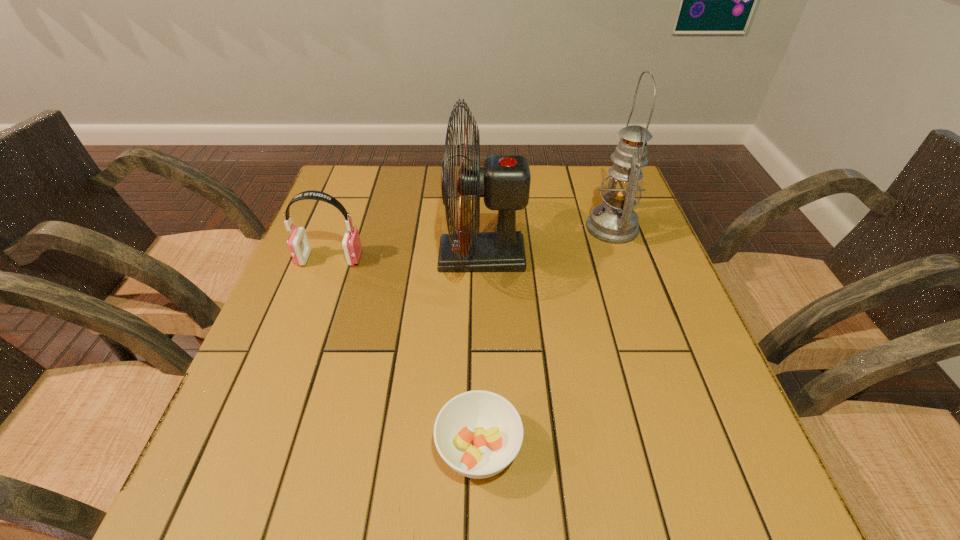
At what (x,y) coordinates should I click in order to perform the action: click on free space between the fan and the oil lamp. Please return your answer as a coordinate pair (x, y). The image size is (960, 540). Looking at the image, I should click on (547, 242).

Locate which object is the third closest to the earphone. Please provide its 2D coordinates. Your answer should be formatted as a tuple, i.e. [(x, y)], where the tuple contains the x and y coordinates of a point satisfying the conditions above.

[(614, 221)]

Where is `the third closest object to the shortest object`? the third closest object to the shortest object is located at coordinates (614, 221).

Locate an element on the screen. This screenshot has width=960, height=540. free space in the image that satisfies the following two spatial constraints: 1. on the outer surface of the soup bowl; 2. on the left side of the leftmost object is located at coordinates (260, 449).

The height and width of the screenshot is (540, 960). Find the location of `free space that satisfies the following two spatial constraints: 1. on the outer surface of the nearest object; 2. on the left side of the third tallest object`. free space that satisfies the following two spatial constraints: 1. on the outer surface of the nearest object; 2. on the left side of the third tallest object is located at coordinates (260, 449).

Locate an element on the screen. The width and height of the screenshot is (960, 540). free spot that satisfies the following two spatial constraints: 1. on the outer surface of the earphone; 2. on the left side of the soup bowl is located at coordinates (260, 449).